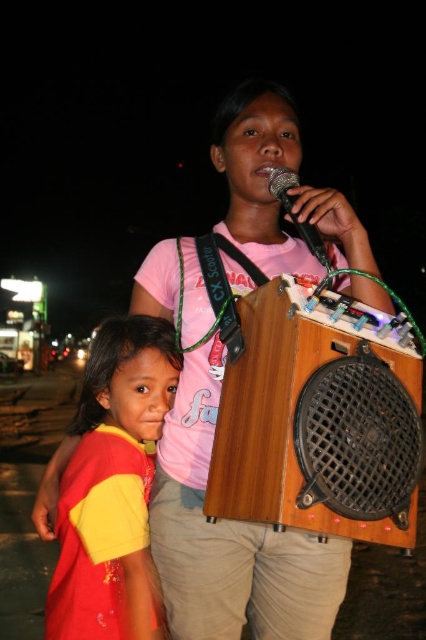
Which of these two, wooden speaker at center or black matte microphone at upper center, stands taller?

wooden speaker at center

Is wooden speaker at center below black matte microphone at upper center?

Correct, wooden speaker at center is located below black matte microphone at upper center.

Find the location of a particular element. The image size is (426, 640). wooden speaker at center is located at coordinates [319, 419].

Consider the image. Which is more to the left, yellow fabric shirt at lower left or black matte microphone at upper center?

yellow fabric shirt at lower left

Who is more distant from viewer, (138, 588) or (307, 225)?

Positioned behind is point (138, 588).

Between point (132, 429) and point (282, 182), which one is positioned behind?

The point (282, 182) is more distant.

Identify the location of yellow fabric shirt at lower left. The height and width of the screenshot is (640, 426). (112, 486).

Is wooden speaker at center positioned at the back of yellow fabric shirt at lower left?

That is False.

Locate an element on the screen. This screenshot has height=640, width=426. wooden speaker at center is located at coordinates (319, 419).

Is point (400, 388) closer to viewer compared to point (83, 426)?

Yes, it is.

Find the location of `wooden speaker at center`. wooden speaker at center is located at coordinates (319, 419).